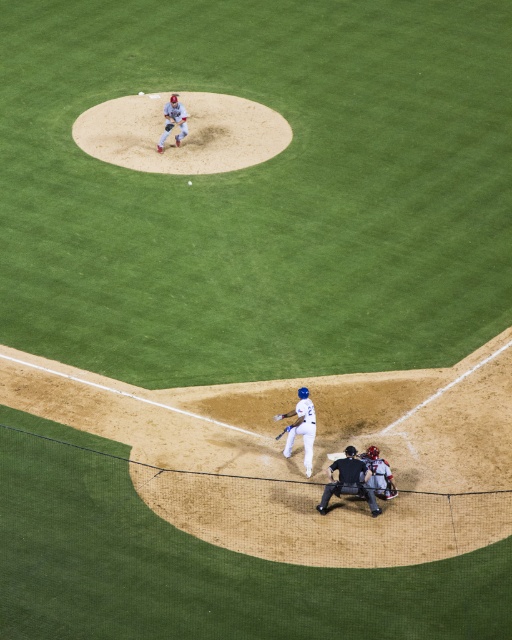
Measure the distance between point (x=166, y=131) and camera.

They are 26.21 meters apart.

Which is behind, point (166, 120) or point (288, 424)?

Positioned behind is point (166, 120).

Is point (167, 124) positioned in front of point (287, 426)?

No, (167, 124) is behind (287, 426).

What are the coordinates of `brown leather glove at upper center` in the screenshot? It's located at (168, 125).

Image resolution: width=512 pixels, height=640 pixels. What do you see at coordinates (378, 474) in the screenshot?
I see `gray matte catcher at lower center` at bounding box center [378, 474].

Who is positioned more to the right, gray matte catcher at lower center or brown leather glove at lower center?

Positioned to the right is gray matte catcher at lower center.

Which is in front, point (376, 460) or point (281, 417)?

Point (376, 460) is in front.

This screenshot has width=512, height=640. What are the coordinates of `gray matte catcher at lower center` in the screenshot? It's located at (378, 474).

Does brown leather glove at upper center have a smaller size compared to brown leather glove at lower center?

No, brown leather glove at upper center is not smaller than brown leather glove at lower center.

Does brown leather glove at upper center come behind brown leather glove at lower center?

Yes, brown leather glove at upper center is further from the viewer.

Which is behind, point (167, 125) or point (280, 417)?

Point (167, 125)

Image resolution: width=512 pixels, height=640 pixels. Find the location of `brown leather glove at upper center`. brown leather glove at upper center is located at coordinates (168, 125).